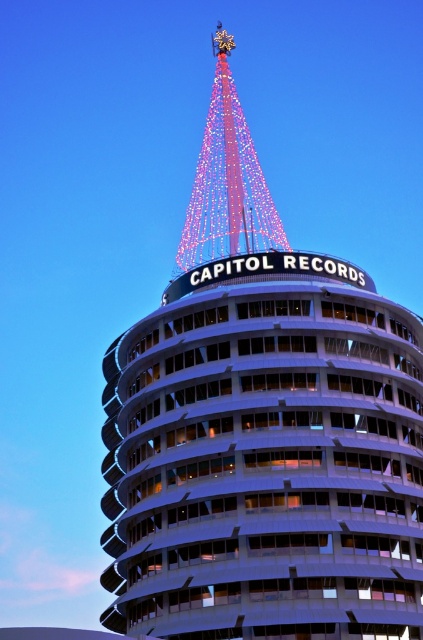
You are standing at the base of the Capitol Records building and want to take a photo of the point at coordinates point (143, 602). If your camera has a maximum focus range of 60 meters, will it be able to focus on that point?

The distance of point (143, 602) from viewer is 58.22 meters, so yes, the camera can focus on the point since it is within the 60 meters range.

You are a photographer planning to capture the Capitol Records building at night. You notice the white glass tower at center and the illuminated glass spire at upper center in your viewfinder. Which object should you focus on if you want to highlight the structure that is closer to the left side of the frame?

The white glass tower at center is positioned on the right side of the illuminated glass spire at upper center, so focusing on the illuminated glass spire at upper center would highlight the structure closer to the left side of the frame.

You are an architect designing a new building and want to ensure that the white glass tower at center has a wider base than the illuminated glass spire at upper center. Does the current design meet this requirement based on the image?

Yes, the white glass tower at center has a greater width than the illuminated glass spire at upper center, so the design meets the requirement.